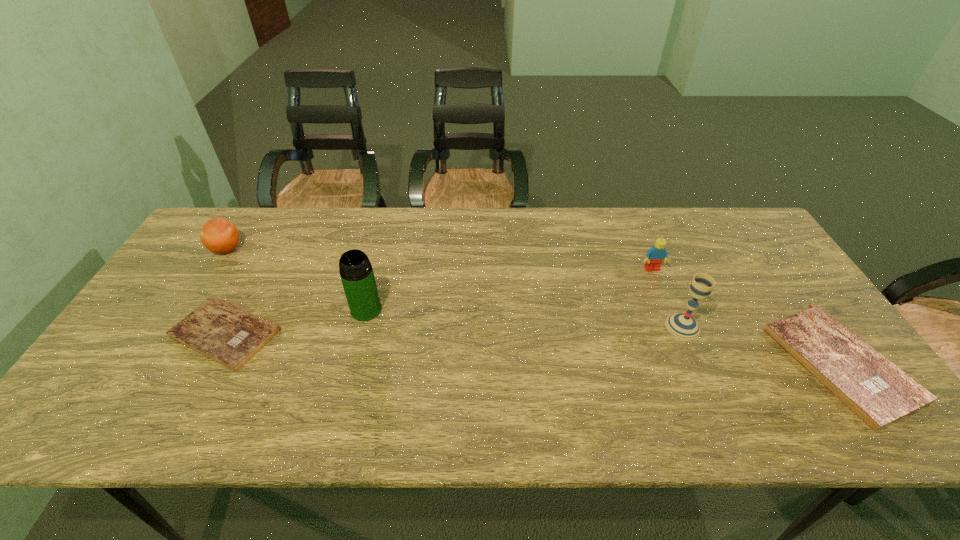
Where is `the shorter Bible`? the shorter Bible is located at coordinates (227, 334).

Where is `the shortest object`? the shortest object is located at coordinates (227, 334).

Locate an element on the screen. The height and width of the screenshot is (540, 960). the taller Bible is located at coordinates (878, 392).

Image resolution: width=960 pixels, height=540 pixels. Find the location of `the right Bible`. the right Bible is located at coordinates (878, 392).

The image size is (960, 540). I want to click on the fifth nearest object, so [655, 255].

Where is `chalice`? The width and height of the screenshot is (960, 540). chalice is located at coordinates (682, 325).

I want to click on orange, so click(x=219, y=235).

You are a GUI agent. You are given a task and a screenshot of the screen. Output one action in this format:
    pyautogui.click(x=<x>, y=<y>)
    Task: Click on the thermos bottle
    This screenshot has width=960, height=540.
    Given the screenshot: What is the action you would take?
    pyautogui.click(x=356, y=272)

Locate an element on the screen. the tallest object is located at coordinates 356,272.

The width and height of the screenshot is (960, 540). I want to click on vacant space positioned 0.220m on the right of the shorter Bible, so click(365, 334).